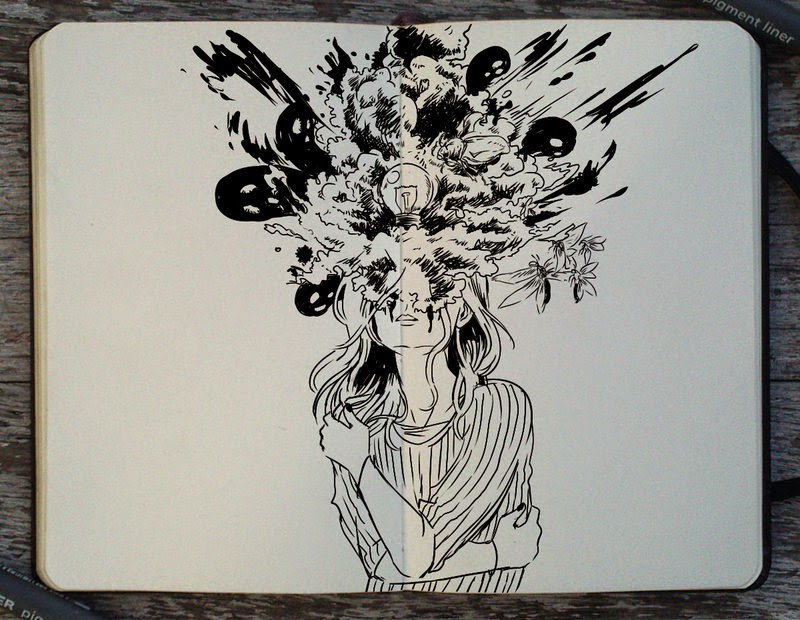
Identify the location of blank journal with illustration. (669, 309), (454, 426), (248, 390).